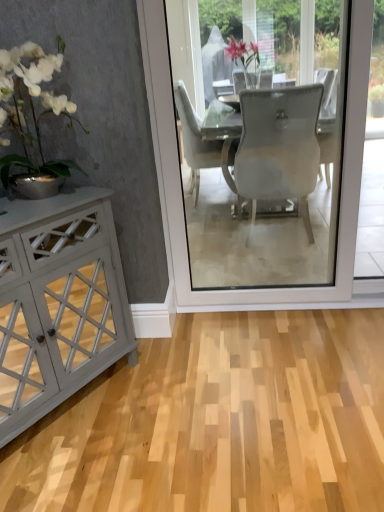
In order to face transparent glass screen door at center, should I rotate leftwards or rightwards?

Turn right approximately 15.453 degrees to face it.

Locate an element on the screen. white glossy vase at left is located at coordinates (32, 119).

You are a GUI agent. You are given a task and a screenshot of the screen. Output one action in this format:
    pyautogui.click(x=<x>, y=<y>)
    Task: Click on the transparent glass screen door at center
    
    Given the screenshot: What is the action you would take?
    pyautogui.click(x=180, y=185)

From the image's perspective, is white glossy vase at left positioned above or below transparent glass screen door at center?

white glossy vase at left is below transparent glass screen door at center.

Is transparent glass screen door at center surrounded by white glossy vase at left?

No.

Does white glossy vase at left turn towards transparent glass screen door at center?

No, white glossy vase at left does not turn towards transparent glass screen door at center.

Is white glossy vase at left further to the viewer compared to transparent glass screen door at center?

No, white glossy vase at left is in front of transparent glass screen door at center.

Based on their positions, is transparent glass screen door at center located to the left or right of white glossy vase at left?

transparent glass screen door at center is positioned on white glossy vase at left's right side.

What's the angular difference between transparent glass screen door at center and white glossy vase at left's facing directions?

55.3 degrees.

Which of these two, transparent glass screen door at center or white glossy vase at left, is thinner?

white glossy vase at left.

From the image's perspective, which is below, transparent glass screen door at center or matte gray cabinet at left?

matte gray cabinet at left, from the image's perspective.

From a real-world perspective, does transparent glass screen door at center sit lower than matte gray cabinet at left?

Correct, in the physical world, transparent glass screen door at center is lower than matte gray cabinet at left.

Is transparent glass screen door at center with matte gray cabinet at left?

No, transparent glass screen door at center is not beside matte gray cabinet at left.

Which object is wider, white glossy vase at left or matte gray cabinet at left?

white glossy vase at left is wider.

Is white glossy vase at left with matte gray cabinet at left?

No, white glossy vase at left is not touching matte gray cabinet at left.

Between white glossy vase at left and matte gray cabinet at left, which one appears on the right side from the viewer's perspective?

Positioned to the right is white glossy vase at left.

Which is closer, (x=40, y=245) or (x=145, y=75)?

Positioned in front is point (x=145, y=75).

Is matte gray cabinet at left with transparent glass screen door at center?

There is a gap between matte gray cabinet at left and transparent glass screen door at center.

You are a GUI agent. You are given a task and a screenshot of the screen. Output one action in this format:
    pyautogui.click(x=<x>, y=<y>)
    Task: Click on the screen door behind the matte gray cabinet at left
    The width and height of the screenshot is (384, 512).
    Given the screenshot: What is the action you would take?
    pyautogui.click(x=180, y=185)

Who is bigger, matte gray cabinet at left or transparent glass screen door at center?

transparent glass screen door at center is bigger.

From a real-world perspective, is matte gray cabinet at left positioned above or below white glossy vase at left?

matte gray cabinet at left is situated lower than white glossy vase at left in the real world.

Is matte gray cabinet at left not close to white glossy vase at left?

No, matte gray cabinet at left is in close proximity to white glossy vase at left.

Is matte gray cabinet at left looking in the opposite direction of white glossy vase at left?

No, matte gray cabinet at left's orientation is not away from white glossy vase at left.

Can you confirm if matte gray cabinet at left is positioned to the right of white glossy vase at left?

Incorrect, matte gray cabinet at left is not on the right side of white glossy vase at left.

You are a GUI agent. You are given a task and a screenshot of the screen. Output one action in this format:
    pyautogui.click(x=<x>, y=<y>)
    Task: Click on the houseplant located above the transparent glass screen door at center (from a real-world perspective)
    This screenshot has height=512, width=384.
    Given the screenshot: What is the action you would take?
    pyautogui.click(x=32, y=119)

Locate an element on the screen. This screenshot has width=384, height=512. screen door that is on the right side of white glossy vase at left is located at coordinates (180, 185).

Based on their spatial positions, is white glossy vase at left or matte gray cabinet at left further from transparent glass screen door at center?

Based on the image, white glossy vase at left appears to be further to transparent glass screen door at center.

From the image, which object appears to be nearer to matte gray cabinet at left, transparent glass screen door at center or white glossy vase at left?

white glossy vase at left is closer to matte gray cabinet at left.

Estimate the real-world distances between objects in this image. Which object is closer to matte gray cabinet at left, white glossy vase at left or transparent glass screen door at center?

white glossy vase at left lies closer to matte gray cabinet at left than the other object.

Which object lies nearer to the anchor point white glossy vase at left, transparent glass screen door at center or matte gray cabinet at left?

matte gray cabinet at left is closer to white glossy vase at left.

Considering their positions, is matte gray cabinet at left positioned further to white glossy vase at left than transparent glass screen door at center?

transparent glass screen door at center.

Looking at the image, which one is located further to transparent glass screen door at center, matte gray cabinet at left or white glossy vase at left?

white glossy vase at left.

At what (x,y) coordinates should I click in order to perform the action: click on houseplant situated between matte gray cabinet at left and transparent glass screen door at center from left to right. Please return your answer as a coordinate pair (x, y). This screenshot has height=512, width=384. Looking at the image, I should click on (32, 119).